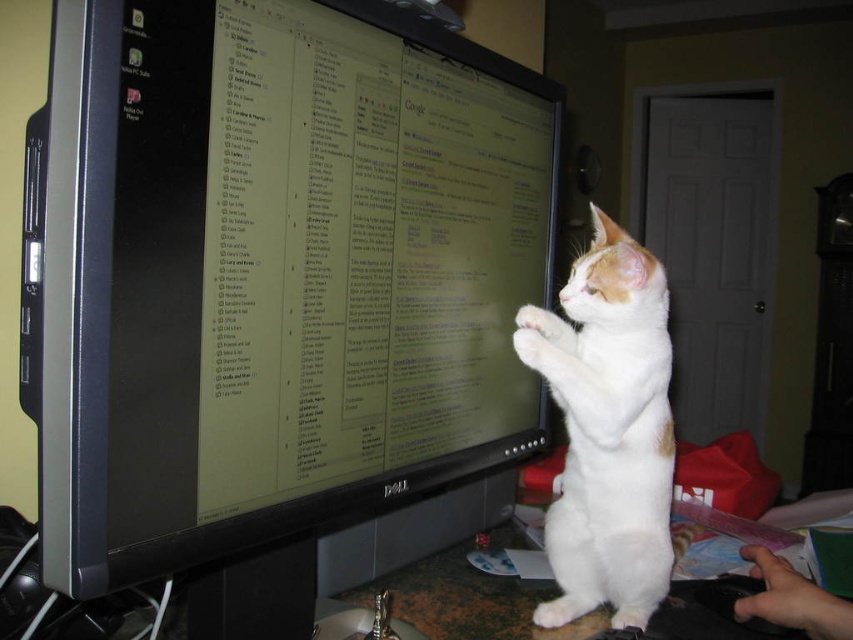
Consider the image. Can you confirm if black glossy monitor at center is wider than white fur cat at right?

Yes.

Between black glossy monitor at center and white fur cat at right, which one has less height?

white fur cat at right is shorter.

Describe the element at coordinates (273, 275) in the screenshot. The height and width of the screenshot is (640, 853). I see `black glossy monitor at center` at that location.

This screenshot has height=640, width=853. Identify the location of black glossy monitor at center. click(273, 275).